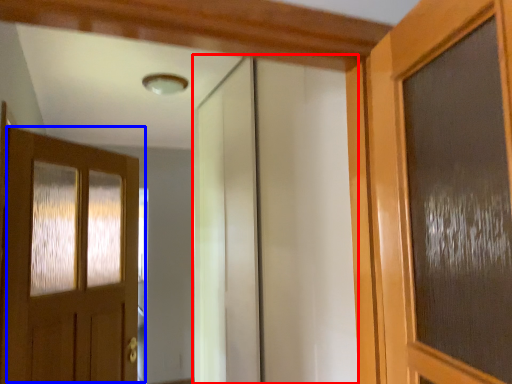
Question: Which point is further to the camera, elevator (highlighted by a red box) or door (highlighted by a blue box)?

Choices:
 (A) elevator
 (B) door

Answer: (B)